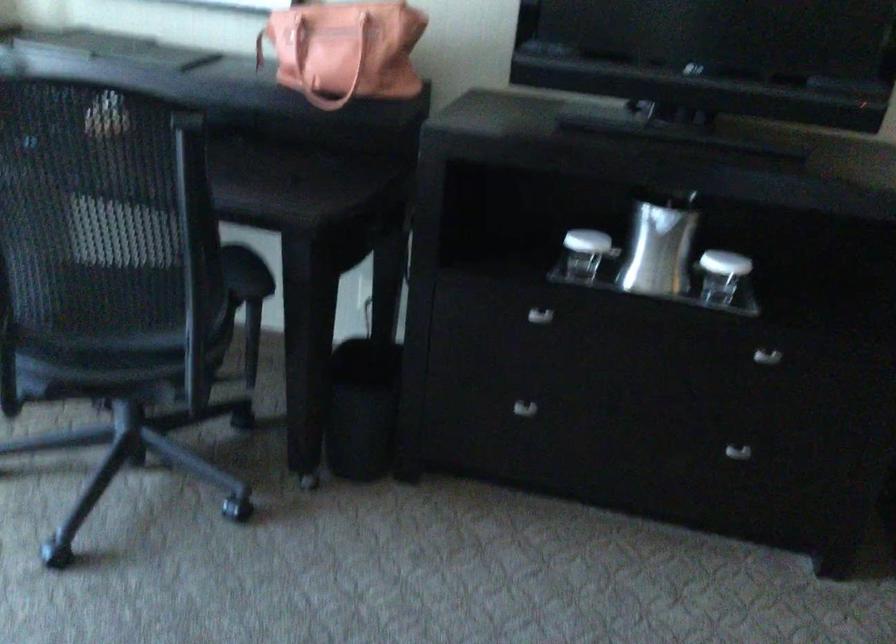
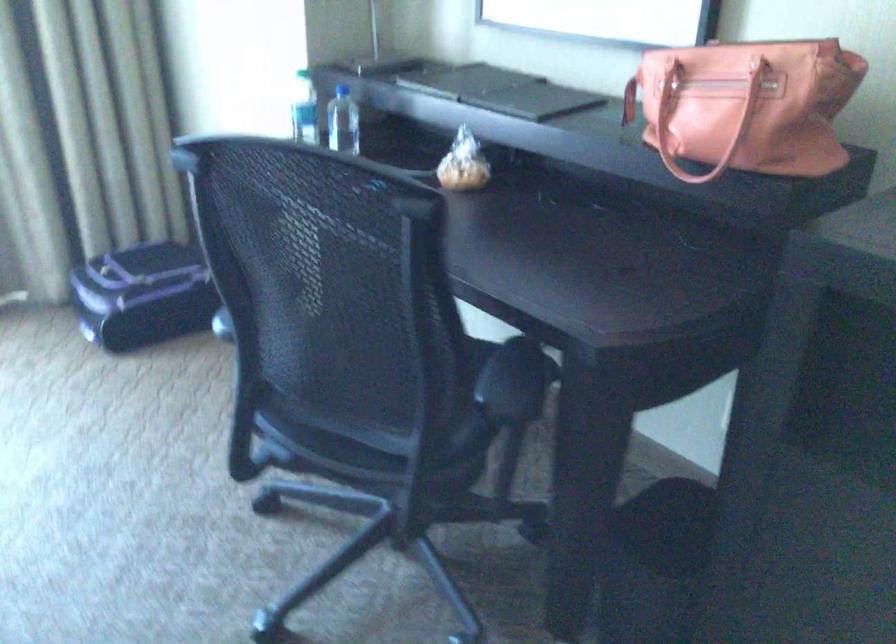
Question: Based on the continuous images, in which direction is the camera rotating? Reply with the corresponding letter.

Choices:
 (A) Left
 (B) Right
 (C) Up
 (D) Down

Answer: (A)